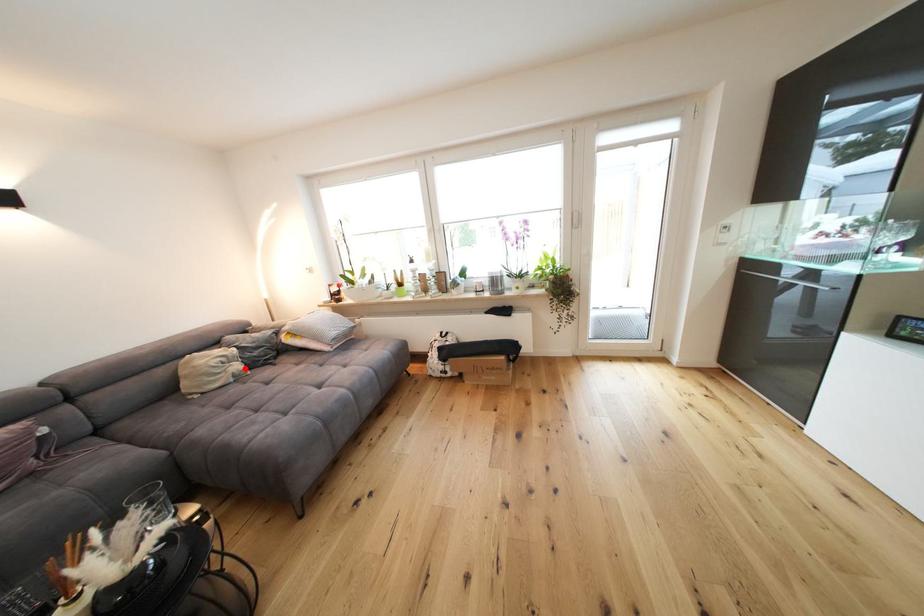
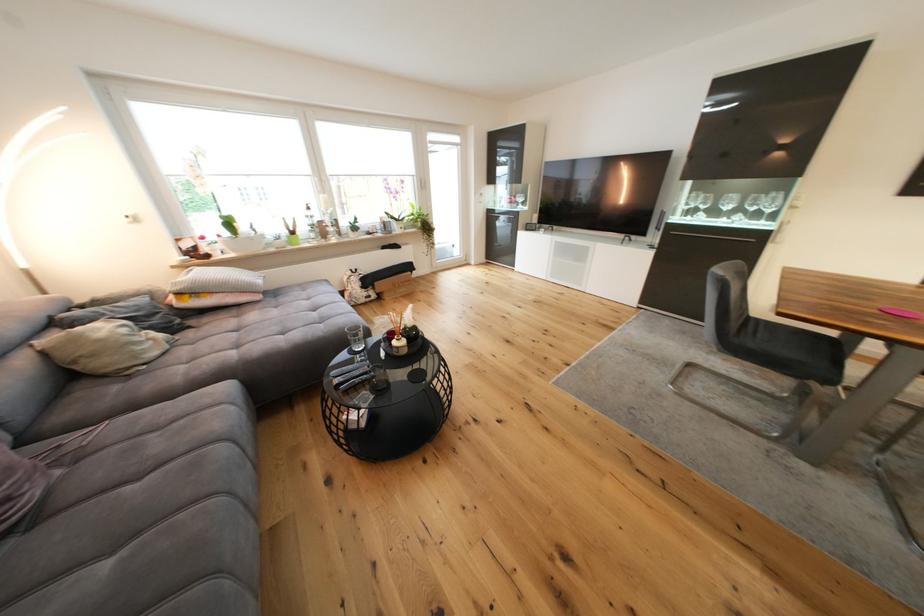
Where in the second image is the point corresponding to the highlighted location from the first image?

(161, 336)